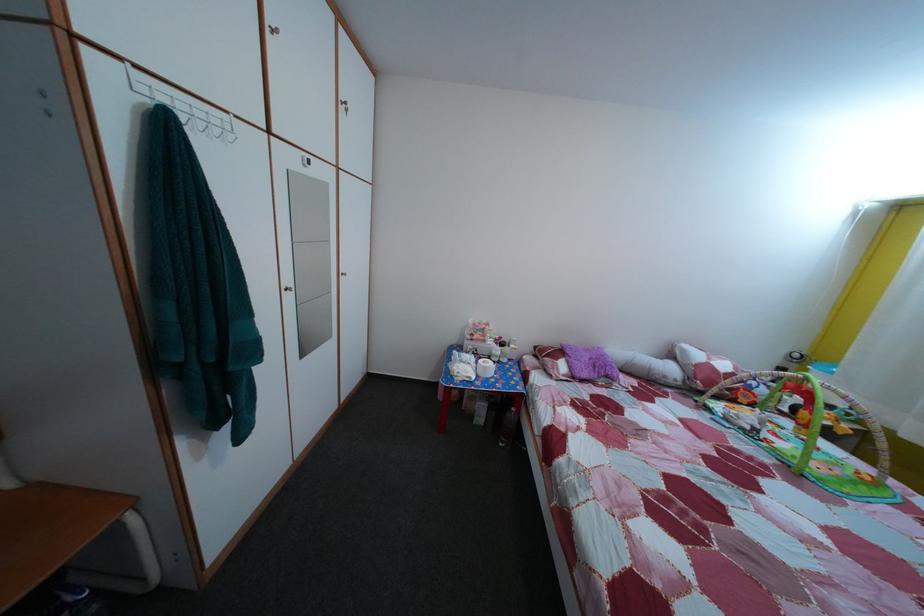
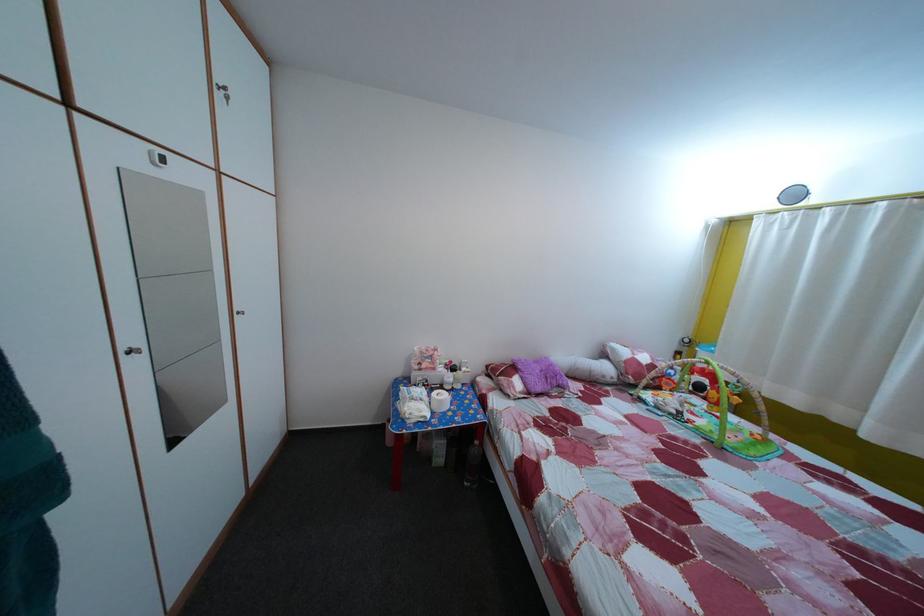
Question: What movement of the cameraman would produce the second image?

Choices:
 (A) Left
 (B) Right
 (C) Forward
 (D) Backward

Answer: (C)